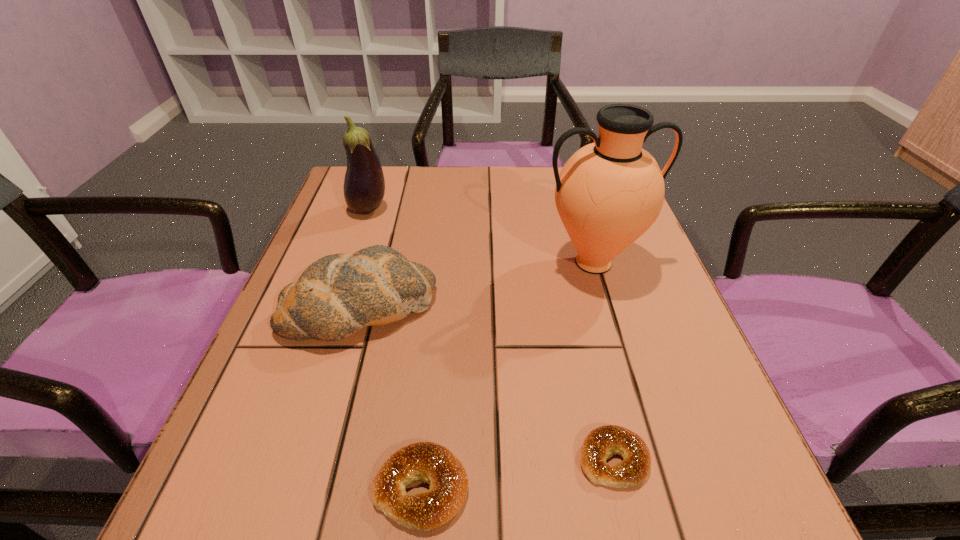
At what (x,y) coordinates should I click in order to perform the action: click on vacant area at the far edge. Please return your answer as a coordinate pair (x, y). This screenshot has width=960, height=540. Looking at the image, I should click on (500, 200).

The height and width of the screenshot is (540, 960). I want to click on free region at the left edge of the desktop, so click(380, 224).

Locate an element on the screen. free region at the right edge of the desktop is located at coordinates (637, 277).

Identify the location of free space at the far left corner of the desktop. Image resolution: width=960 pixels, height=540 pixels. (346, 166).

In the image, there is a desktop. Identify the location of vacant space at the near left corner. [x=295, y=537].

You are a GUI agent. You are given a task and a screenshot of the screen. Output one action in this format:
    pyautogui.click(x=<x>, y=<y>)
    Task: Click on the free area in between the second shortest object and the pitcher
    Image resolution: width=960 pixels, height=540 pixels.
    Given the screenshot: What is the action you would take?
    pyautogui.click(x=508, y=375)

This screenshot has width=960, height=540. I want to click on blank region between the eggplant and the tallest object, so click(481, 236).

The image size is (960, 540). Identify the location of free space between the farthest object and the shorter bagel. (491, 334).

Identify the location of free space between the eggplant and the tallest object. (481, 236).

The width and height of the screenshot is (960, 540). Identify the location of free space between the tallest object and the shorter bagel. (604, 361).